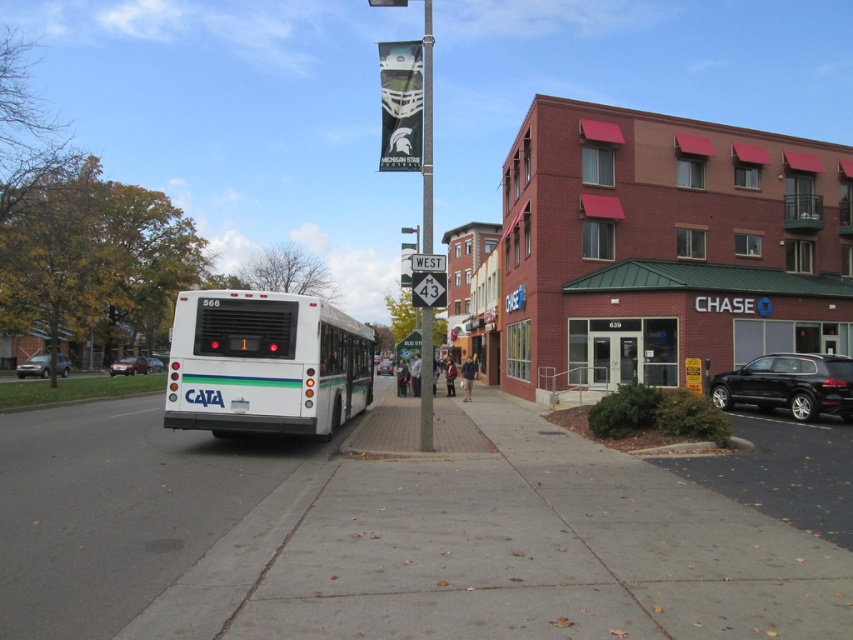
You are a pedestrian standing on the gray concrete sidewalk at center. You want to cross the street to reach a store located behind the metallic silver sedan at center. Which direction should you walk along the sidewalk to find a safe crossing point?

The gray concrete sidewalk at center is positioned on the right side of the metallic silver sedan at center. Therefore, to reach the store behind the sedan, you should walk to the left along the sidewalk since the sedan is on your right side.

You are a pedestrian standing on the sidewalk and want to cross the street to reach a store across the road. The white matte bus at center and the shiny black suv at right are parked on the road. Which vehicle is closer to you?

The white matte bus at center is closer to you because it is in front of the shiny black suv at right, meaning it is positioned between you and the suv.

You are standing at the point with coordinates [503,552] in the image. What type of surface are you currently standing on?

The point at coordinates [503,552] corresponds to the gray concrete sidewalk at center, so you are standing on a gray concrete sidewalk.